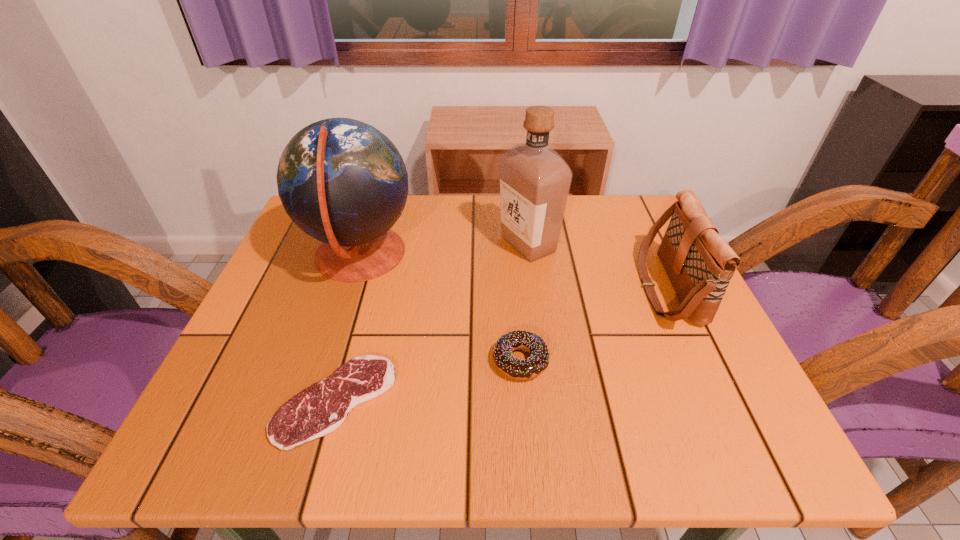
The height and width of the screenshot is (540, 960). Find the location of `vacant space situated on the front-facing side of the shoulder bag`. vacant space situated on the front-facing side of the shoulder bag is located at coordinates (576, 288).

Identify the location of vacant space located on the front-facing side of the shoulder bag. (505, 288).

Identify the location of vacant region located 0.110m on the front-facing side of the shoulder bag. (590, 288).

Find the location of `free spot located on the right of the doughnut`. free spot located on the right of the doughnut is located at coordinates (683, 361).

You are a GUI agent. You are given a task and a screenshot of the screen. Output one action in this format:
    pyautogui.click(x=<x>, y=<y>)
    Task: Click on the vacant point located on the back of the shortest object
    This screenshot has height=540, width=960.
    Given the screenshot: What is the action you would take?
    pyautogui.click(x=374, y=262)

You are a GUI agent. You are given a task and a screenshot of the screen. Output one action in this format:
    pyautogui.click(x=<x>, y=<y>)
    Task: Click on the liquor that is at the far edge
    The image size is (960, 540).
    Given the screenshot: What is the action you would take?
    pyautogui.click(x=535, y=180)

The width and height of the screenshot is (960, 540). Identify the location of globe situated at the far edge. (343, 182).

Where is `shoulder bag located at the far edge`? shoulder bag located at the far edge is located at coordinates (699, 263).

In order to click on object present at the near edge in this screenshot , I will do `click(320, 409)`.

At what (x,y) coordinates should I click in order to perform the action: click on globe situated at the left edge. Please return your answer as a coordinate pair (x, y). Image resolution: width=960 pixels, height=540 pixels. Looking at the image, I should click on pyautogui.click(x=343, y=182).